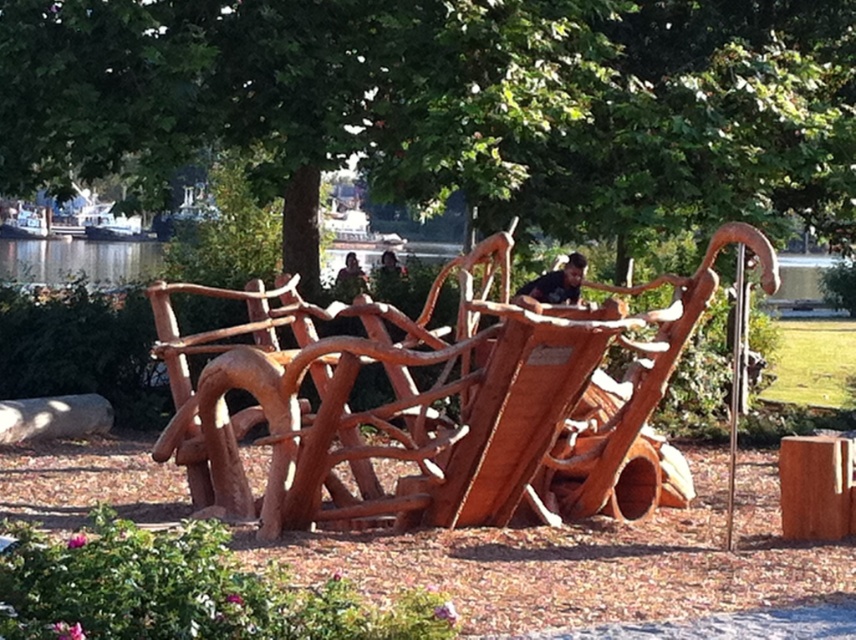
Between point (804, 3) and point (330, 342), which one is positioned behind?

The point (804, 3) is behind.

Is natural wood tree at center below natural wood sleigh at center?

No.

Measure the distance between point (635, 19) and camera.

16.52 meters

Identify the location of natural wood tree at center. (447, 104).

Does brown wooden bench at center have a greater width compared to matte brown wooden bench at center?

Indeed, brown wooden bench at center has a greater width compared to matte brown wooden bench at center.

From the picture: Does brown wooden bench at center have a larger size compared to matte brown wooden bench at center?

Yes.

Is point (536, 289) positioned after point (366, 280)?

No.

Find the location of a particular element. This screenshot has width=856, height=640. brown wooden bench at center is located at coordinates click(x=557, y=282).

Between natural wood sleigh at center and brown wooden bench at center, which one has more height?

natural wood sleigh at center is taller.

Does point (438, 400) come closer to viewer compared to point (571, 301)?

Yes, it is in front of point (571, 301).

This screenshot has width=856, height=640. I want to click on natural wood sleigh at center, so click(x=432, y=401).